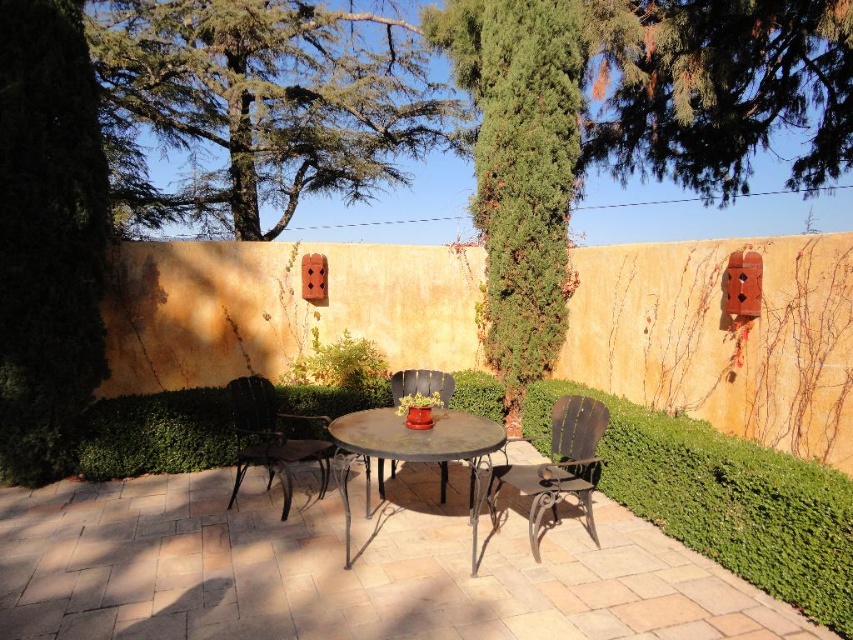
You are standing on the patio and want to move from the green leafy tree at left to the dark brown wrought iron chair at center. Which direction should you walk to get closer to the chair?

You should walk towards the center of the patio because the dark brown wrought iron chair at center is closer to you than the green leafy tree at left, which is further away.

You are planning to install a new ceiling fan in the patio. The fan requires a minimum clearance of 2.5 meters from the ground to the ceiling. Given the height of the green leafy tree at left and dark brown wrought iron chair at center, can you determine if the patio ceiling is high enough?

The green leafy tree at left has a greater height compared to dark brown wrought iron chair at center. However, the height of the tree and chair alone cannot determine the ceiling height. The ceiling fan requirement is unrelated to the objects provided. More information about the actual ceiling height is needed to answer this question.